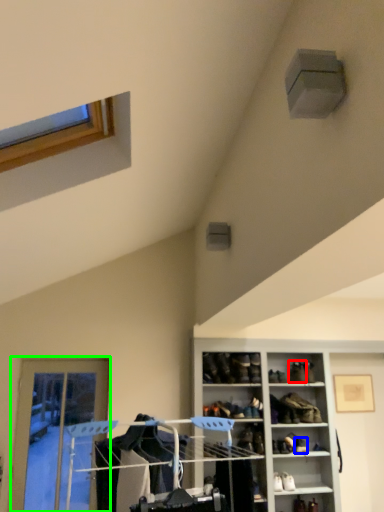
Question: Which object is the farthest from shoe (highlighted by a red box)? Choose among these: shoe (highlighted by a blue box) or door (highlighted by a green box).

Choices:
 (A) shoe
 (B) door

Answer: (B)